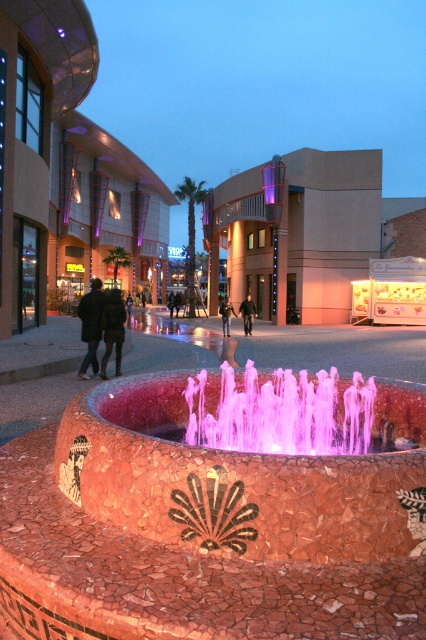
Question: Among these points, which one is nearest to the camera?

Choices:
 (A) (169, 486)
 (B) (115, 320)
 (C) (244, 328)

Answer: (A)

Question: Is pink mosaic fountain at center closer to camera compared to dark gray jacket at center?

Choices:
 (A) no
 (B) yes

Answer: (B)

Question: Is the position of dark brown leather jacket at lower left more distant than that of dark green fabric jacket at left?

Choices:
 (A) no
 (B) yes

Answer: (A)

Question: Which point is closer to the camera?

Choices:
 (A) dark brown leather jacket at lower left
 (B) pink mosaic fountain at center
 (C) dark green fabric jacket at left

Answer: (B)

Question: Observing the image, what is the correct spatial positioning of pink mosaic fountain at center in reference to dark gray jacket at center?

Choices:
 (A) left
 (B) right

Answer: (A)

Question: Among these points, which one is farthest from the camera?

Choices:
 (A) (106, 314)
 (B) (249, 317)
 (C) (230, 512)
 (D) (230, 308)

Answer: (D)